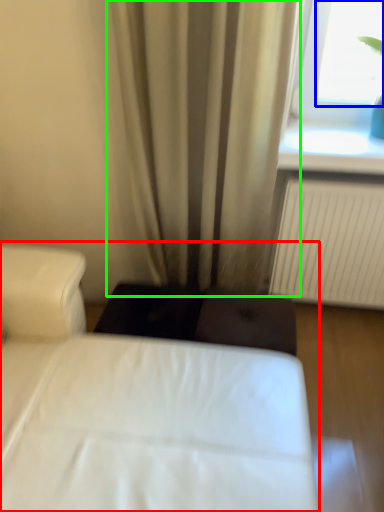
Question: Based on their relative distances, which object is nearer to bed (highlighted by a red box)? Choose from window screen (highlighted by a blue box) and curtain (highlighted by a green box).

Choices:
 (A) window screen
 (B) curtain

Answer: (B)